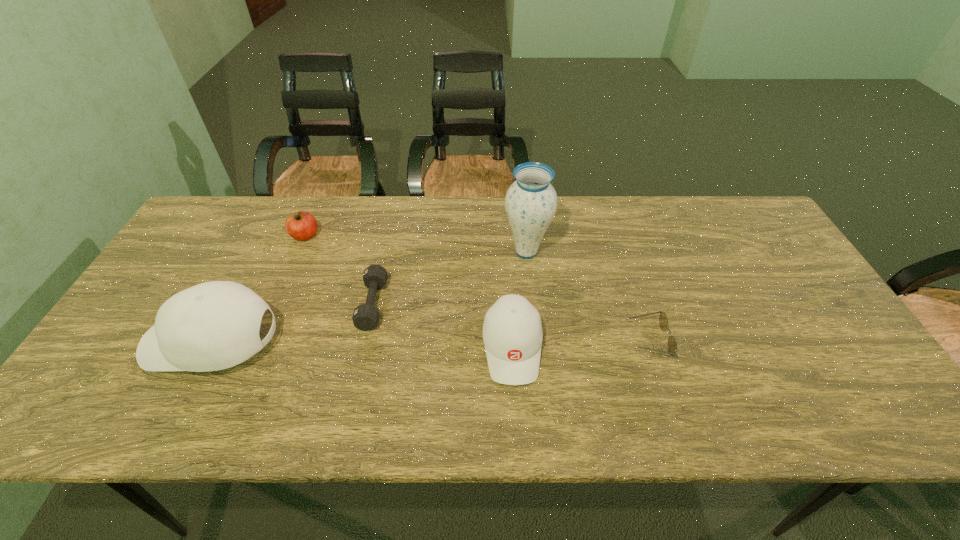
Find the location of a particular element. The image size is (960, 540). the second tallest object is located at coordinates (215, 325).

Find the location of a particular element. the left baseball cap is located at coordinates (215, 325).

The image size is (960, 540). Find the location of `the fourth shortest object`. the fourth shortest object is located at coordinates (512, 331).

This screenshot has height=540, width=960. I want to click on the right baseball cap, so click(512, 331).

You are a GUI agent. You are given a task and a screenshot of the screen. Output one action in this format:
    pyautogui.click(x=<x>, y=<y>)
    Task: Click on the third shortest object
    Image resolution: width=960 pixels, height=540 pixels.
    Given the screenshot: What is the action you would take?
    pyautogui.click(x=301, y=225)

Find the location of a particular element. Image resolution: width=960 pixels, height=540 pixels. the fifth tallest object is located at coordinates (366, 316).

At what (x,y) coordinates should I click in order to perform the action: click on dumbbell. Please return your answer as a coordinate pair (x, y). Looking at the image, I should click on (366, 316).

Find the location of a particular element. This screenshot has width=960, height=540. the tallest object is located at coordinates (531, 201).

Find the location of a particular element. The height and width of the screenshot is (540, 960). the rightmost object is located at coordinates (663, 321).

This screenshot has height=540, width=960. In order to click on spectacles in this screenshot , I will do `click(663, 321)`.